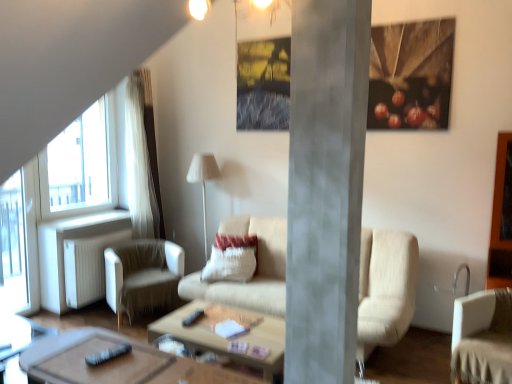
Question: Which direction should I rotate to look at wooden coffee table at center, marked as the 2th coffee table in a front-to-back arrangement, — up or down?

Choices:
 (A) up
 (B) down

Answer: (B)

Question: Is wooden polished coffee table at center, which is counted as the first coffee table, starting from the front, smaller than white textured pillow at center?

Choices:
 (A) no
 (B) yes

Answer: (A)

Question: From the image's perspective, does wooden polished coffee table at center, which is counted as the first coffee table, starting from the front, appear lower than white textured pillow at center?

Choices:
 (A) yes
 (B) no

Answer: (A)

Question: Does wooden polished coffee table at center, which is counted as the first coffee table, starting from the front, appear on the left side of white textured pillow at center?

Choices:
 (A) yes
 (B) no

Answer: (A)

Question: Considering the relative sizes of wooden polished coffee table at center, which is counted as the first coffee table, starting from the front, and white textured pillow at center in the image provided, is wooden polished coffee table at center, which is counted as the first coffee table, starting from the front, taller than white textured pillow at center?

Choices:
 (A) yes
 (B) no

Answer: (B)

Question: Is wooden polished coffee table at center, which appears as the second coffee table when viewed from the back, looking in the opposite direction of white textured pillow at center?

Choices:
 (A) no
 (B) yes

Answer: (A)

Question: Considering the relative positions of wooden polished coffee table at center, which appears as the second coffee table when viewed from the back, and white textured pillow at center in the image provided, is wooden polished coffee table at center, which appears as the second coffee table when viewed from the back, to the right of white textured pillow at center from the viewer's perspective?

Choices:
 (A) yes
 (B) no

Answer: (B)

Question: Is white fabric chair at lower right, marked as the second chair in a back-to-front arrangement, at the left side of concrete pillar at center?

Choices:
 (A) no
 (B) yes

Answer: (A)

Question: Is white fabric chair at lower right, which appears as the second chair when viewed from the left, closer to the viewer compared to concrete pillar at center?

Choices:
 (A) yes
 (B) no

Answer: (B)

Question: Can we say white fabric chair at lower right, the first chair in the front-to-back sequence, lies outside concrete pillar at center?

Choices:
 (A) yes
 (B) no

Answer: (A)

Question: From a real-world perspective, is white fabric chair at lower right, arranged as the first chair when viewed from the right, below concrete pillar at center?

Choices:
 (A) yes
 (B) no

Answer: (A)

Question: From the image's perspective, is white fabric chair at lower right, marked as the second chair in a back-to-front arrangement, over concrete pillar at center?

Choices:
 (A) yes
 (B) no

Answer: (B)

Question: Can you confirm if white fabric chair at lower right, arranged as the first chair when viewed from the right, is thinner than concrete pillar at center?

Choices:
 (A) no
 (B) yes

Answer: (A)

Question: Is white fabric chair at lower right, marked as the second chair in a back-to-front arrangement, inside transparent glass window at left?

Choices:
 (A) no
 (B) yes

Answer: (A)